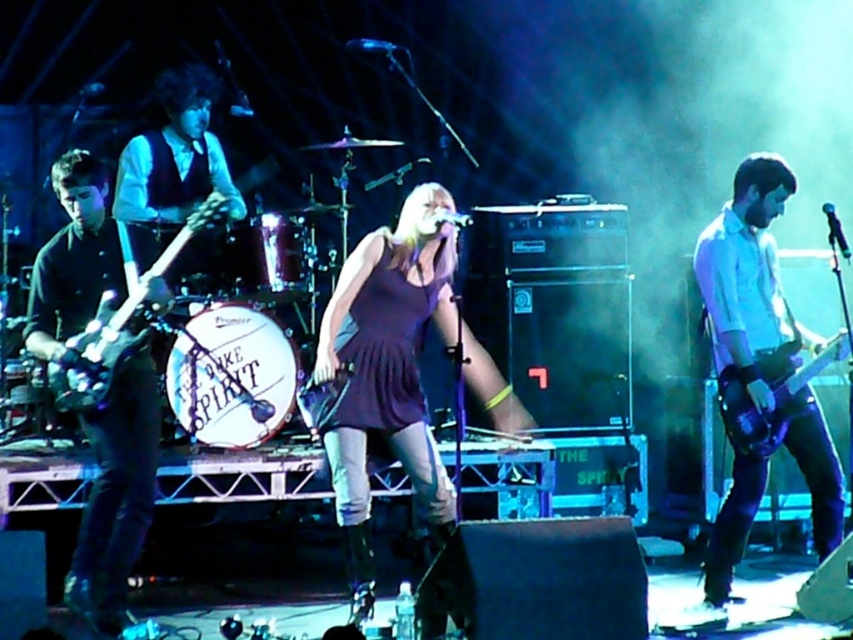
Question: Is matte white shirt at right smaller than shiny black electric guitar at left?

Choices:
 (A) yes
 (B) no

Answer: (B)

Question: Is purple satin dress at center closer to the viewer compared to shiny purple electric guitar at right?

Choices:
 (A) yes
 (B) no

Answer: (A)

Question: Which object is the closest to the matte white shirt at right?

Choices:
 (A) shiny black electric guitar at left
 (B) shiny purple electric guitar at right
 (C) matte black guitar at left

Answer: (B)

Question: Which object is positioned farthest from the purple satin dress at center?

Choices:
 (A) matte white shirt at right
 (B) shiny black electric guitar at left
 (C) shiny purple electric guitar at right
 (D) matte black guitar at left

Answer: (C)

Question: Is matte white shirt at right positioned in front of shiny black electric guitar at left?

Choices:
 (A) yes
 (B) no

Answer: (B)

Question: Which is nearer to the matte black guitar at left?

Choices:
 (A) shiny purple electric guitar at right
 (B) matte white shirt at right
 (C) shiny black electric guitar at left

Answer: (C)